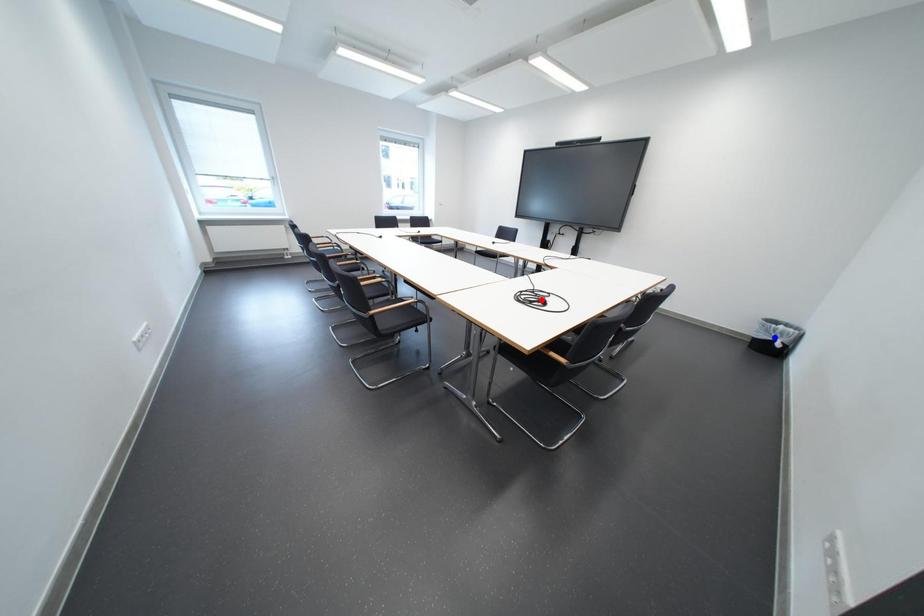
Question: Which of the two points in the image is closer to the camera?

Choices:
 (A) Blue point is closer.
 (B) Red point is closer.

Answer: (B)